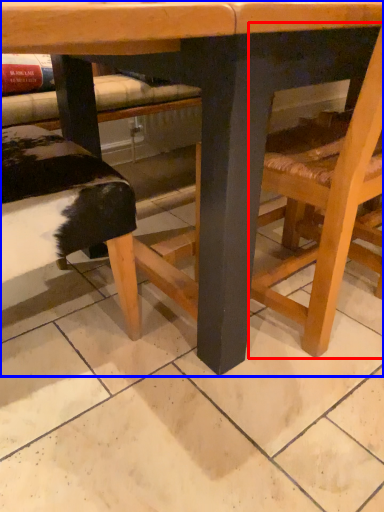
Question: Which of the following is the farthest to the observer, chair (highlighted by a red box) or table (highlighted by a blue box)?

Choices:
 (A) chair
 (B) table

Answer: (A)